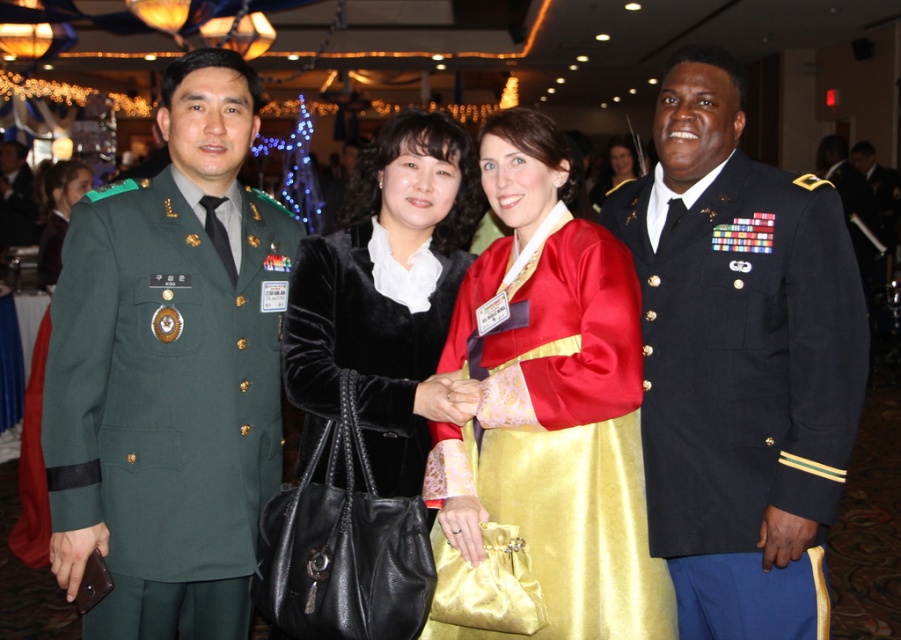
Question: Can you confirm if green military uniform at left is positioned to the left of velvet black coat at center?

Choices:
 (A) no
 (B) yes

Answer: (B)

Question: Based on their relative distances, which object is nearer to the matte black dress at center?

Choices:
 (A) satin kimono at center
 (B) velvet black coat at center
 (C) green military uniform at left

Answer: (B)

Question: Which of the following is the farthest from the observer?

Choices:
 (A) (617, 147)
 (B) (319, 355)
 (C) (675, 81)
 (D) (57, 243)

Answer: (A)

Question: Is velvet black coat at upper left positioned at the back of matte black dress at center?

Choices:
 (A) yes
 (B) no

Answer: (B)

Question: Does satin kimono at center appear on the right side of velvet black coat at upper left?

Choices:
 (A) yes
 (B) no

Answer: (A)

Question: Considering the real-world distances, which object is farthest from the satin kimono at center?

Choices:
 (A) shiny black uniform at right
 (B) velvet black coat at upper left
 (C) matte black dress at center
 (D) velvet black coat at center

Answer: (C)